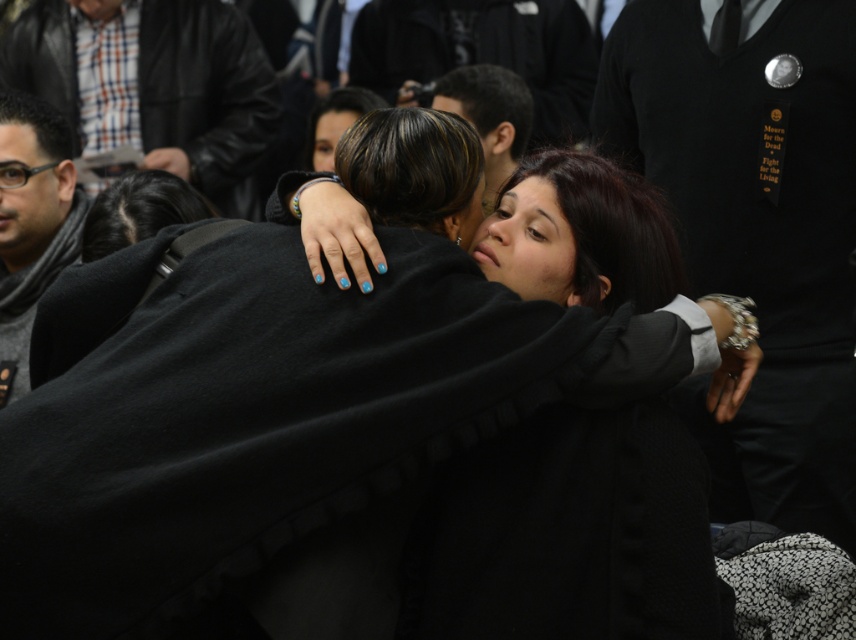
You are a photographer trying to capture the two individuals embracing in the image. To ensure the leather jacket at upper left is not in the frame, where should you position yourself relative to the scene?

The leather jacket at upper left is located at point (207,96). To avoid including it in the frame, position yourself such that the camera does not capture the upper left area of the scene.

You are a photographer setting up for a group photo. You notice the leather jacket at upper left and the gray knit scarf at left in the frame. Based on their sizes, which object would you need to adjust your camera angle to better capture in full without cropping?

The leather jacket at upper left is wider than the gray knit scarf at left, so you should adjust your camera angle to accommodate the larger width of the leather jacket at upper left to ensure it fits in the frame without cropping.

You are a photographer trying to capture a closeup of the gray knit scarf at left and the dark brown hair at center. Which object should you zoom in on first to ensure it fills the frame properly?

The gray knit scarf at left is much taller than the dark brown hair at center, so you should zoom in on the gray knit scarf at left first to ensure it fills the frame properly.